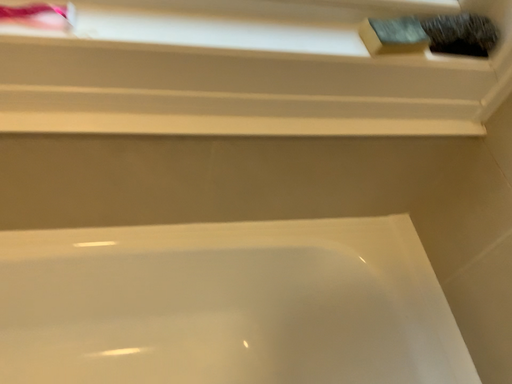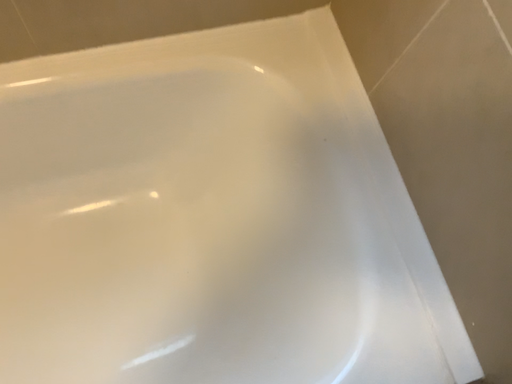
Question: How did the camera likely rotate when shooting the video?

Choices:
 (A) rotated upward
 (B) rotated downward

Answer: (B)